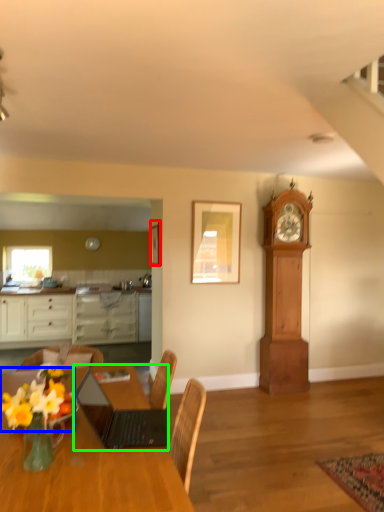
Question: Which object is positioned farthest from picture frame (highlighted by a red box)? Select from flower (highlighted by a blue box) and laptop (highlighted by a green box).

Choices:
 (A) flower
 (B) laptop

Answer: (A)